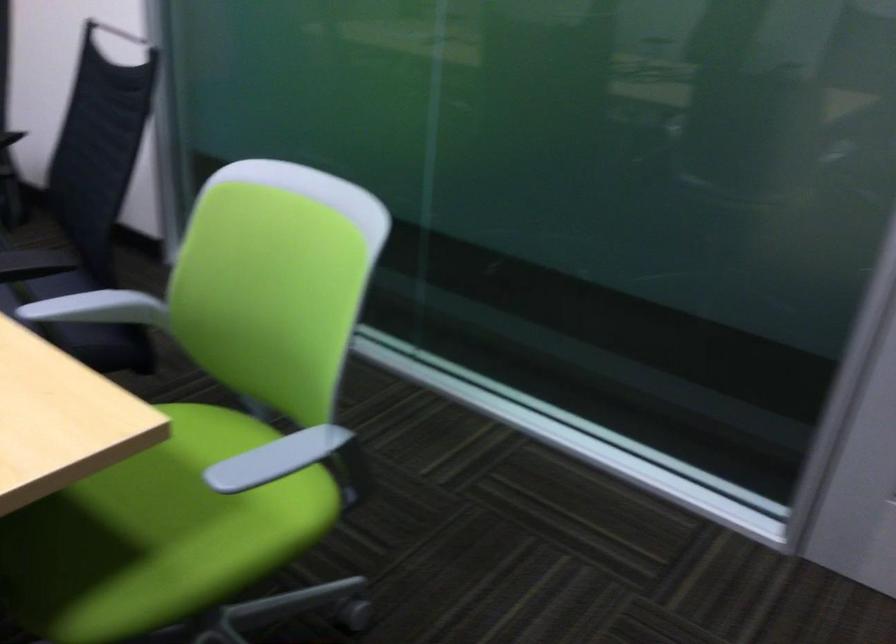
You are a GUI agent. You are given a task and a screenshot of the screen. Output one action in this format:
    pyautogui.click(x=<x>, y=<y>)
    Task: Click on the green chair sitting surface
    
    Given the screenshot: What is the action you would take?
    pyautogui.click(x=157, y=534)